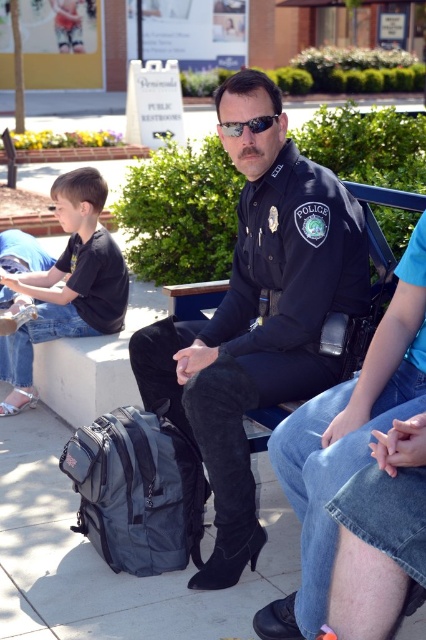
Question: Can you confirm if dark blue uniform at center is positioned above black matte shirt at left?

Choices:
 (A) yes
 (B) no

Answer: (B)

Question: Among these points, which one is nearest to the camera?

Choices:
 (A) (273, 116)
 (B) (233, 557)
 (C) (25, 372)

Answer: (B)

Question: From the image, what is the correct spatial relationship of dark blue uniform at center in relation to black matte shirt at left?

Choices:
 (A) right
 (B) left

Answer: (A)

Question: Which point is closer to the camera taking this photo?

Choices:
 (A) (227, 129)
 (B) (111, 280)
 (C) (181, 410)

Answer: (A)

Question: Which point is farther to the camera?

Choices:
 (A) dark blue uniform at center
 (B) black matte shirt at left
 (C) black reflective sunglasses at center

Answer: (B)

Question: In this image, where is dark blue uniform at center located relative to black reflective sunglasses at center?

Choices:
 (A) below
 (B) above

Answer: (A)